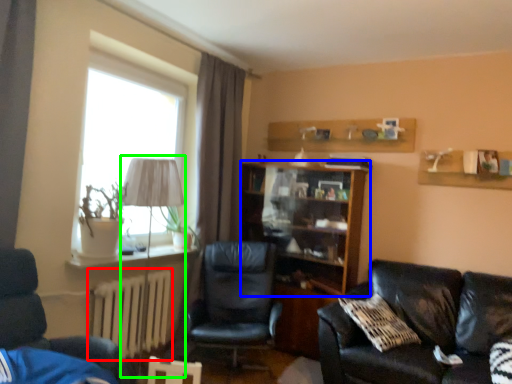
Question: Which is farther away from radiator (highlighted by a red box)? shelf (highlighted by a blue box) or table lamp (highlighted by a green box)?

Choices:
 (A) shelf
 (B) table lamp

Answer: (A)